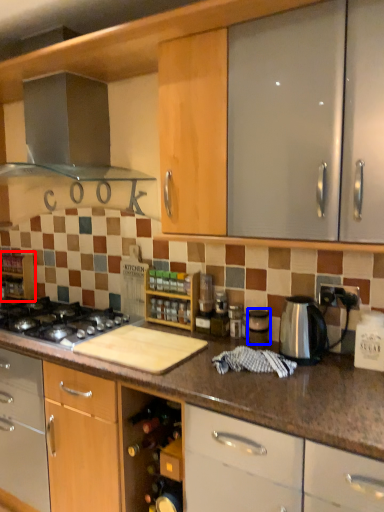
Question: Which object appears farthest to the camera in this image, shelf (highlighted by a red box) or appliance (highlighted by a blue box)?

Choices:
 (A) shelf
 (B) appliance

Answer: (A)